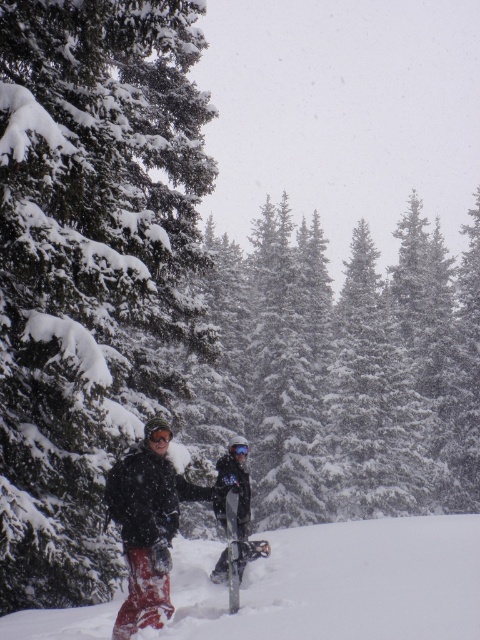
Is red snowboard at lower left to the left of snowboard at center from the viewer's perspective?

Incorrect, red snowboard at lower left is not on the left side of snowboard at center.

Where is `red snowboard at lower left`? This screenshot has width=480, height=640. red snowboard at lower left is located at coordinates (337, 582).

Can you confirm if snow-covered evergreen tree at left is taller than matte black snowshoe at center?

Yes.

Is snow-covered evergreen tree at left above matte black snowshoe at center?

Yes.

Find the location of `snow-covered evergreen tree at left`. snow-covered evergreen tree at left is located at coordinates (91, 268).

Measure the distance between snowboard at center and camera.

A distance of 8.70 meters exists between snowboard at center and camera.

Measure the distance between point (164, 512) and camera.

Point (164, 512) and camera are 31.07 feet apart from each other.

The width and height of the screenshot is (480, 640). Describe the element at coordinates (148, 524) in the screenshot. I see `snowboard at center` at that location.

The height and width of the screenshot is (640, 480). In order to click on snowboard at center in this screenshot , I will do `click(148, 524)`.